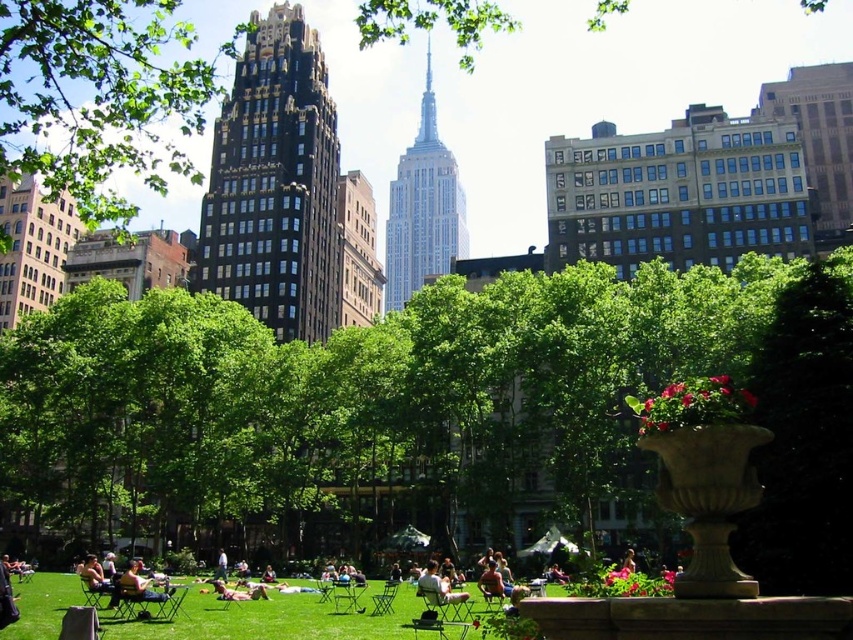
In the scene shown: You are a photographer wanting to capture both the light brown wooden chair at lower left and the light brown wooden chair at lower center in a single frame. Since you want both chairs to be visible, which chair should you position yourself closer to in order to include both in your shot?

You should position yourself closer to the light brown wooden chair at lower center. Since the light brown wooden chair at lower left is to the left of light brown wooden chair at lower center, moving closer to the chair on the right allows you to encompass both chairs within the camera frame more effectively.

You are a park visitor wanting to place a small picnic basket between the green leafy tree at center and the light brown wooden chair at center. Based on their widths, which object should you position the basket closer to?

The green leafy tree at center is wider than the light brown wooden chair at center. Position the basket closer to the chair to ensure it fits within the available space.